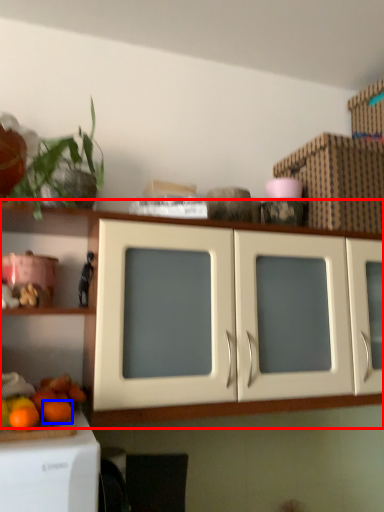
Question: Which point is further to the camera, cabinetry (highlighted by a red box) or orange (highlighted by a blue box)?

Choices:
 (A) cabinetry
 (B) orange

Answer: (B)